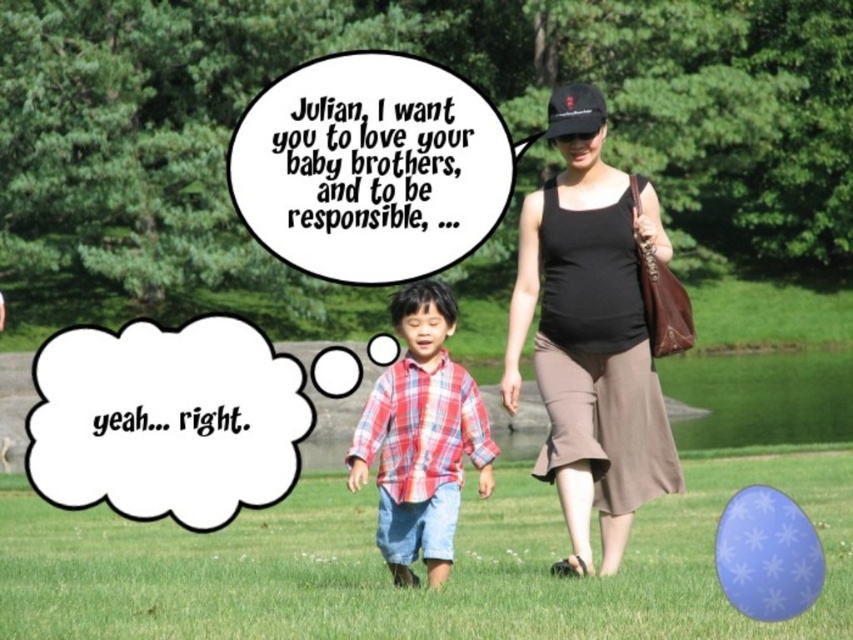
Which is more to the right, plaid fabric shirt at center or black fabric baseball cap at upper center?

black fabric baseball cap at upper center is more to the right.

Can you confirm if plaid fabric shirt at center is smaller than black fabric baseball cap at upper center?

Incorrect, plaid fabric shirt at center is not smaller in size than black fabric baseball cap at upper center.

Locate an element on the screen. plaid fabric shirt at center is located at coordinates (421, 436).

At what (x,y) coordinates should I click in order to perform the action: click on plaid fabric shirt at center. Please return your answer as a coordinate pair (x, y). The width and height of the screenshot is (853, 640). Looking at the image, I should click on (421, 436).

Which is behind, point (151, 634) or point (440, 465)?

The point (440, 465) is behind.

Describe the element at coordinates (387, 576) in the screenshot. The image size is (853, 640). I see `green grass at lower center` at that location.

Is point (170, 582) less distant than point (412, 528)?

No, it is not.

Where is `green grass at lower center`? The height and width of the screenshot is (640, 853). green grass at lower center is located at coordinates (387, 576).

Is green grass at lower center below black fabric baseball cap at upper center?

Indeed, green grass at lower center is positioned under black fabric baseball cap at upper center.

Which of these two, green grass at lower center or black fabric baseball cap at upper center, stands taller?

With more height is green grass at lower center.

Between point (671, 556) and point (573, 131), which one is positioned in front?

Point (573, 131) is more forward.

Image resolution: width=853 pixels, height=640 pixels. Identify the location of green grass at lower center. (387, 576).